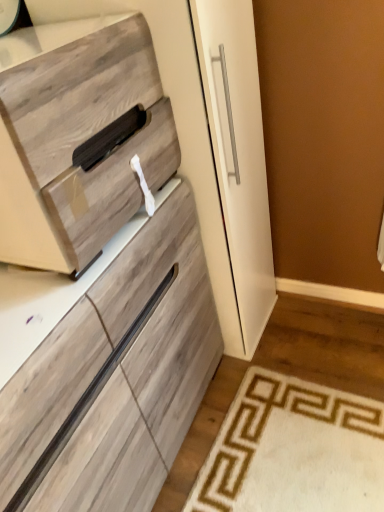
The height and width of the screenshot is (512, 384). Find the location of `wooden drawer at left`. wooden drawer at left is located at coordinates (x=81, y=144).

Describe the element at coordinates (81, 144) in the screenshot. I see `wooden drawer at left` at that location.

This screenshot has height=512, width=384. What are the coordinates of `wooden drawer at left` in the screenshot? It's located at (81, 144).